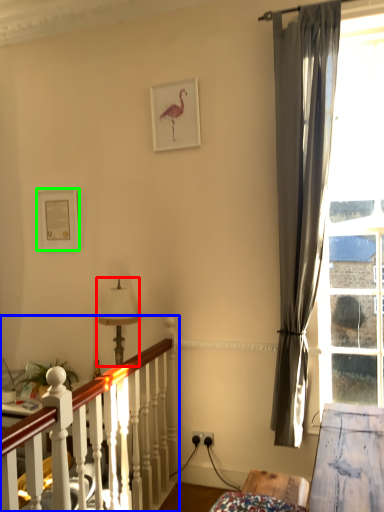
Question: Which object is the farthest from table lamp (highlighted by a red box)? Choose among these: bed frame (highlighted by a blue box) or picture frame (highlighted by a green box).

Choices:
 (A) bed frame
 (B) picture frame

Answer: (A)